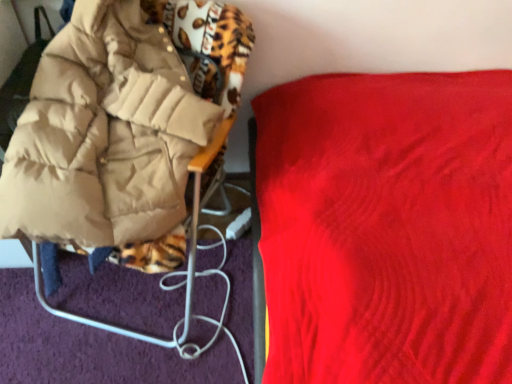
Question: Should I look upward or downward to see velvet red blanket at upper right, positioned as the 2th furniture in left-to-right order?

Choices:
 (A) up
 (B) down

Answer: (B)

Question: Is matte beige jacket at left, positioned as the 1th furniture in left-to-right order, at the back of velvet red blanket at upper right, placed as the 1th furniture when sorted from right to left?

Choices:
 (A) no
 (B) yes

Answer: (A)

Question: Considering the relative sizes of velvet red blanket at upper right, placed as the 1th furniture when sorted from right to left, and matte beige jacket at left, positioned as the 1th furniture in left-to-right order, in the image provided, is velvet red blanket at upper right, placed as the 1th furniture when sorted from right to left, wider than matte beige jacket at left, positioned as the 1th furniture in left-to-right order,?

Choices:
 (A) no
 (B) yes

Answer: (B)

Question: Would you say velvet red blanket at upper right, placed as the 1th furniture when sorted from right to left, is outside matte beige jacket at left, positioned as the 1th furniture in left-to-right order?

Choices:
 (A) no
 (B) yes

Answer: (B)

Question: Is velvet red blanket at upper right, positioned as the 2th furniture in left-to-right order, thinner than matte beige jacket at left, positioned as the 1th furniture in left-to-right order?

Choices:
 (A) yes
 (B) no

Answer: (B)

Question: From the image's perspective, is velvet red blanket at upper right, positioned as the 2th furniture in left-to-right order, on top of matte beige jacket at left, positioned as the 1th furniture in left-to-right order?

Choices:
 (A) no
 (B) yes

Answer: (A)

Question: Is velvet red blanket at upper right, placed as the 1th furniture when sorted from right to left, at the right side of matte beige jacket at left, arranged as the 2th furniture when viewed from the right?

Choices:
 (A) no
 (B) yes

Answer: (B)

Question: Can you confirm if matte beige jacket at left, arranged as the 2th furniture when viewed from the right, is shorter than velvet red blanket at upper right, placed as the 1th furniture when sorted from right to left?

Choices:
 (A) no
 (B) yes

Answer: (B)

Question: Does matte beige jacket at left, arranged as the 2th furniture when viewed from the right, have a greater height compared to velvet red blanket at upper right, placed as the 1th furniture when sorted from right to left?

Choices:
 (A) yes
 (B) no

Answer: (B)

Question: Is matte beige jacket at left, arranged as the 2th furniture when viewed from the right, thinner than velvet red blanket at upper right, placed as the 1th furniture when sorted from right to left?

Choices:
 (A) yes
 (B) no

Answer: (A)

Question: Is matte beige jacket at left, positioned as the 1th furniture in left-to-right order, oriented away from velvet red blanket at upper right, placed as the 1th furniture when sorted from right to left?

Choices:
 (A) yes
 (B) no

Answer: (B)

Question: Is matte beige jacket at left, arranged as the 2th furniture when viewed from the right, to the left of velvet red blanket at upper right, placed as the 1th furniture when sorted from right to left, from the viewer's perspective?

Choices:
 (A) yes
 (B) no

Answer: (A)

Question: Considering the relative sizes of matte beige jacket at left, arranged as the 2th furniture when viewed from the right, and velvet red blanket at upper right, positioned as the 2th furniture in left-to-right order, in the image provided, is matte beige jacket at left, arranged as the 2th furniture when viewed from the right, wider than velvet red blanket at upper right, positioned as the 2th furniture in left-to-right order,?

Choices:
 (A) no
 (B) yes

Answer: (A)

Question: From the image's perspective, relative to matte beige jacket at left, arranged as the 2th furniture when viewed from the right, is velvet red blanket at upper right, positioned as the 2th furniture in left-to-right order, above or below?

Choices:
 (A) above
 (B) below

Answer: (B)